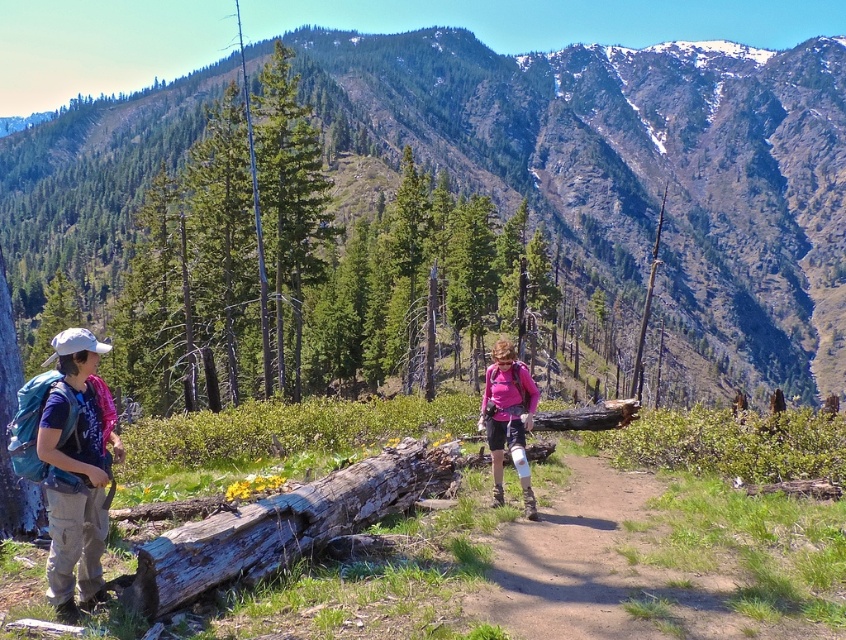
Question: Can you confirm if green forested mountain at upper center is bigger than brown dirt path at center?

Choices:
 (A) no
 (B) yes

Answer: (B)

Question: Is weathered wood log at center further to the viewer compared to pink fabric at center?

Choices:
 (A) yes
 (B) no

Answer: (B)

Question: Does green forested mountain at upper center appear on the left side of weathered wood log at center?

Choices:
 (A) no
 (B) yes

Answer: (A)

Question: Which point is closer to the camera?

Choices:
 (A) (498, 132)
 (B) (509, 369)
 (C) (72, 529)

Answer: (C)

Question: Among these objects, which one is nearest to the camera?

Choices:
 (A) pink fabric at center
 (B) green forested mountain at upper center

Answer: (A)

Question: Which of the following is the farthest from the observer?

Choices:
 (A) (404, 470)
 (B) (806, 104)

Answer: (B)